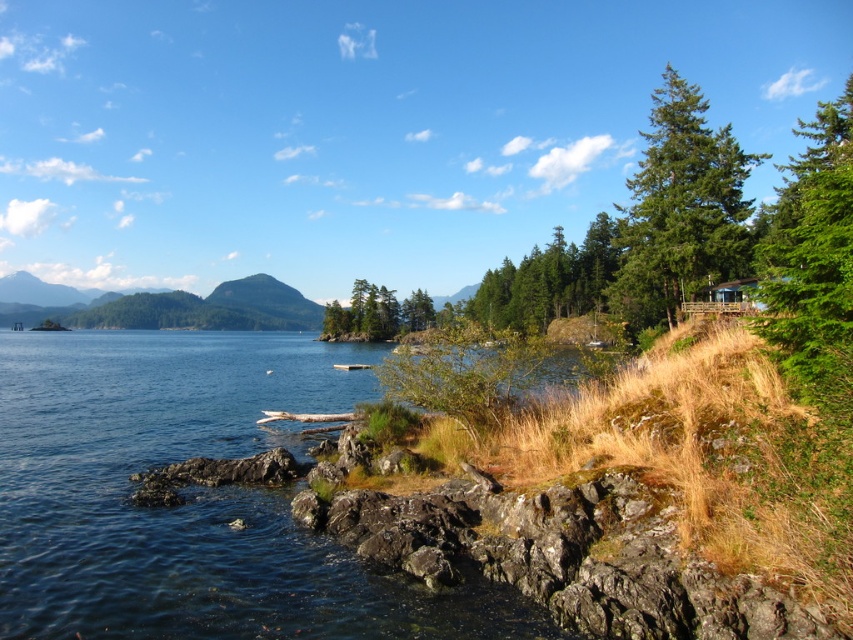
Question: Which object is farther from the camera taking this photo?

Choices:
 (A) green matte tree at upper right
 (B) clear blue water at lower left
 (C) green matte tree at center
 (D) green textured tree at upper right

Answer: (C)

Question: Based on their relative distances, which object is nearer to the green matte tree at center?

Choices:
 (A) green textured tree at upper right
 (B) clear blue water at lower left

Answer: (B)

Question: Can you confirm if clear blue water at lower left is positioned above green textured tree at upper right?

Choices:
 (A) yes
 (B) no

Answer: (B)

Question: Does clear blue water at lower left appear on the left side of green matte tree at upper right?

Choices:
 (A) no
 (B) yes

Answer: (B)

Question: Is green matte tree at upper right bigger than green matte tree at center?

Choices:
 (A) yes
 (B) no

Answer: (A)

Question: Which is farther from the green matte tree at center?

Choices:
 (A) clear blue water at lower left
 (B) green textured tree at upper right

Answer: (B)